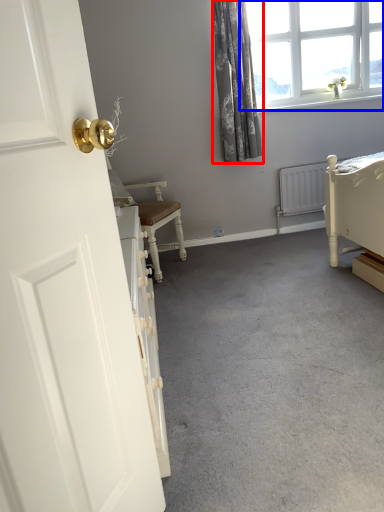
Question: Which object appears farthest to the camera in this image, curtain (highlighted by a red box) or window (highlighted by a blue box)?

Choices:
 (A) curtain
 (B) window

Answer: (B)